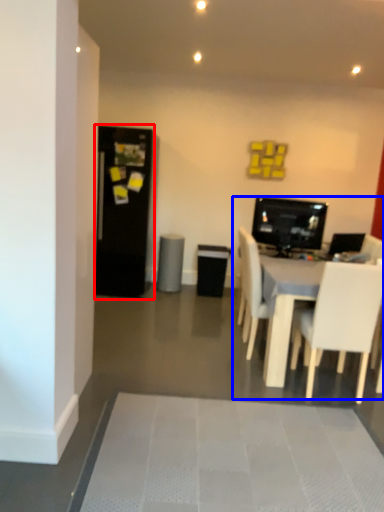
Question: Which of the following is the closest to the observer, fridge (highlighted by a red box) or entertainment center (highlighted by a blue box)?

Choices:
 (A) fridge
 (B) entertainment center

Answer: (B)